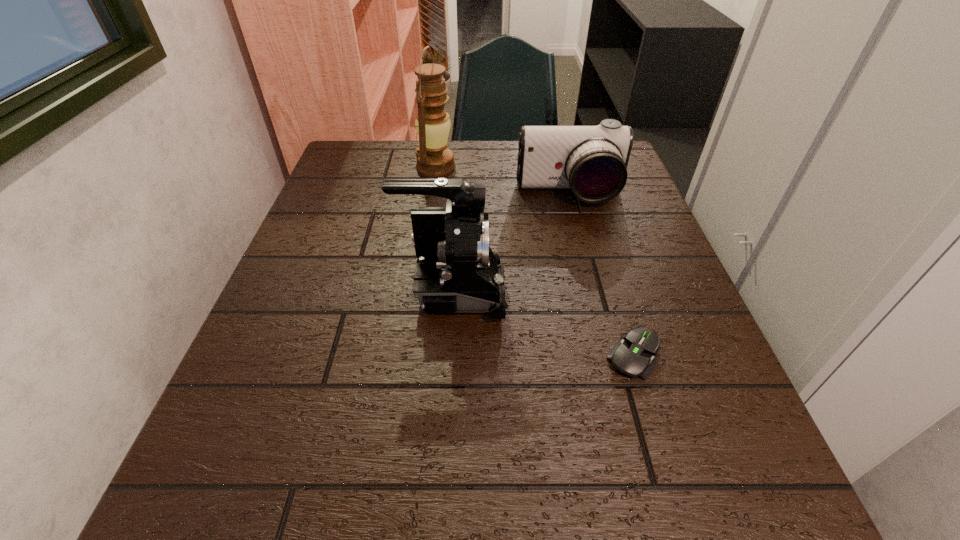
What are the coordinates of `free point between the nearest object and the tallest object` in the screenshot? It's located at (535, 261).

At what (x,y) coordinates should I click in order to perform the action: click on free spot between the computer mouse and the nearer camcorder. Please return your answer as a coordinate pair (x, y). The image size is (960, 540). Looking at the image, I should click on (543, 323).

Locate an element on the screen. vacant space that's between the oil lamp and the right camcorder is located at coordinates (502, 180).

Where is `free space between the farther camcorder and the tallest object`? free space between the farther camcorder and the tallest object is located at coordinates pos(502,180).

In order to click on free space between the tallest object and the computer mouse in this screenshot , I will do `click(535, 261)`.

Where is `the closest object to the nearer camcorder`? the closest object to the nearer camcorder is located at coordinates (632, 356).

Point out which object is positioned as the nearest to the shortest object. Please provide its 2D coordinates. Your answer should be formatted as a tuple, i.e. [(x, y)], where the tuple contains the x and y coordinates of a point satisfying the conditions above.

[(456, 269)]

Image resolution: width=960 pixels, height=540 pixels. In order to click on vacant space that satisfies the following two spatial constraints: 1. on the surface of the nearest object; 2. on the left side of the right camcorder in this screenshot , I will do `click(611, 355)`.

Identify the location of free space that satisfies the following two spatial constraints: 1. on the lens mount of the nearest object; 2. on the right side of the third farthest object. Image resolution: width=960 pixels, height=540 pixels. (449, 355).

What are the coordinates of `free space in the image that satisfies the following two spatial constraints: 1. on the lens mount of the taller camcorder; 2. on the right side of the shortest object` in the screenshot? It's located at (449, 355).